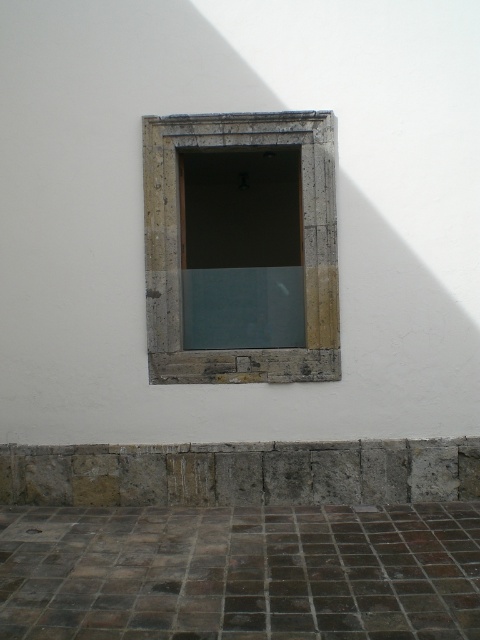
Question: Is stone/rough concrete ledge at lower center below stone/rough textured window frame at center?

Choices:
 (A) yes
 (B) no

Answer: (A)

Question: Which point is closer to the camera taking this photo?

Choices:
 (A) (333, 356)
 (B) (446, 492)

Answer: (B)

Question: Does stone/rough concrete ledge at lower center have a smaller size compared to stone/rough textured window frame at center?

Choices:
 (A) yes
 (B) no

Answer: (A)

Question: Is stone/rough concrete ledge at lower center above stone/rough textured window frame at center?

Choices:
 (A) no
 (B) yes

Answer: (A)